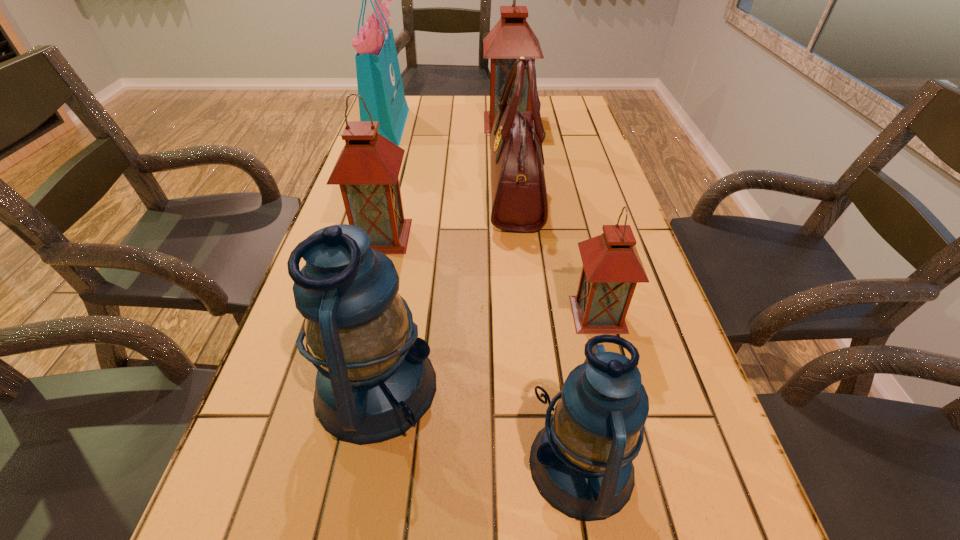
The height and width of the screenshot is (540, 960). What are the coordinates of `the tallest lantern` in the screenshot? It's located at (512, 37).

Find the location of a particular element. This screenshot has width=960, height=540. the biggest pink lantern is located at coordinates (512, 37).

I want to click on shopping bag, so click(x=379, y=81).

Where is `brown handbag`? Image resolution: width=960 pixels, height=540 pixels. brown handbag is located at coordinates (518, 189).

Locate an element on the screen. the fourth nearest lantern is located at coordinates (367, 170).

I want to click on the second nearest pink lantern, so click(x=367, y=170).

What are the coordinates of `the bigger blue lantern` in the screenshot? It's located at (374, 381).

Locate an element on the screen. This screenshot has height=540, width=960. the smaller blue lantern is located at coordinates (581, 462).

You are a GUI agent. You are given a task and a screenshot of the screen. Output one action in this format:
    pyautogui.click(x=<x>, y=<y>)
    Task: Click on the nearest pink lantern
    
    Given the screenshot: What is the action you would take?
    pyautogui.click(x=612, y=267)

Identify the location of vacant region located 0.160m on the right of the farthest pink lantern. (580, 122).